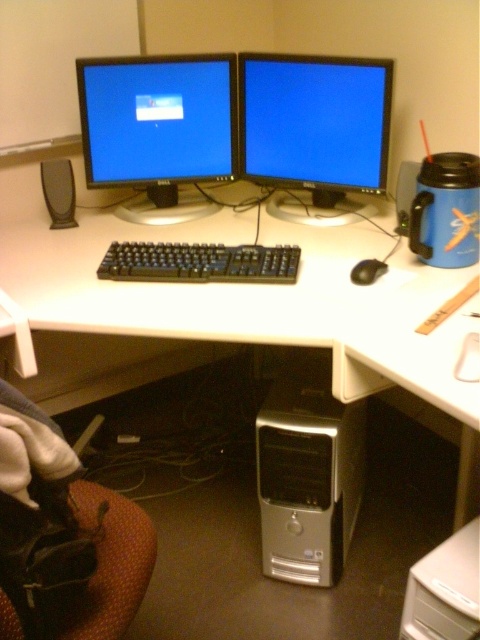
Question: Is brown fabric swivel chair at lower left smaller than black plastic keyboard at center?

Choices:
 (A) yes
 (B) no

Answer: (B)

Question: Can you confirm if white plastic computer desk at center is positioned to the right of brown fabric swivel chair at lower left?

Choices:
 (A) no
 (B) yes

Answer: (B)

Question: Which of the following is the farthest from the observer?

Choices:
 (A) (202, 248)
 (B) (85, 550)
 (C) (63, 224)
 (D) (267, 548)

Answer: (C)

Question: Which of these objects is positioned farthest from the silver metallic computer tower at center?

Choices:
 (A) black matte speaker at left
 (B) brown fabric swivel chair at lower left
 (C) matte black monitor at center
 (D) black matte mouse at center

Answer: (A)

Question: Can you confirm if silver metallic computer tower at center is positioned below black matte mouse at center?

Choices:
 (A) yes
 (B) no

Answer: (A)

Question: Which object is closer to the camera taking this photo?

Choices:
 (A) black plastic keyboard at center
 (B) matte black monitor at upper left

Answer: (A)